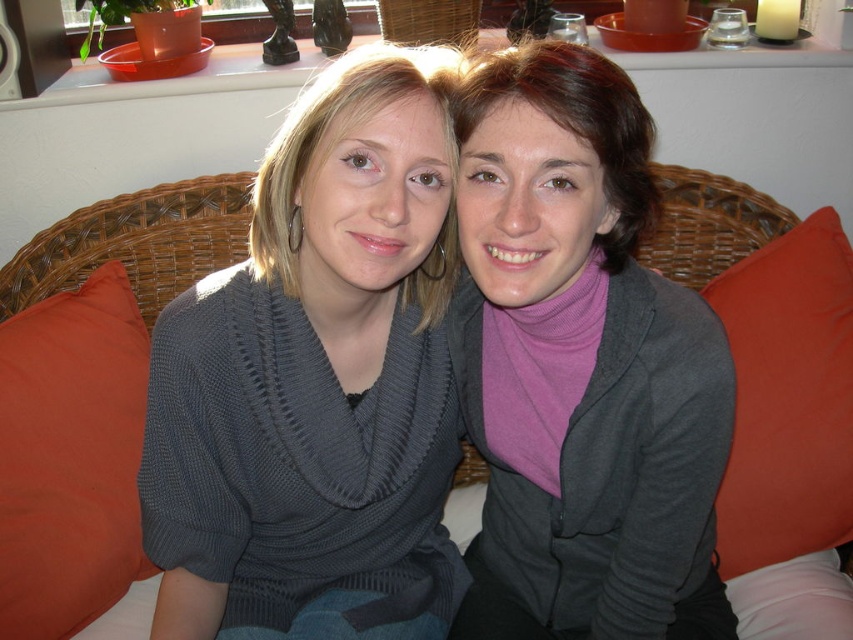
Question: Can you confirm if purple matte turtleneck at center is positioned to the right of orange fabric pillow at right?

Choices:
 (A) yes
 (B) no

Answer: (B)

Question: Is orange fabric pillow at left thinner than woven wicker couch at center?

Choices:
 (A) no
 (B) yes

Answer: (B)

Question: Which of the following is the farthest from the observer?

Choices:
 (A) (283, 518)
 (B) (712, 634)
 (C) (181, 189)
 (D) (735, 509)

Answer: (C)

Question: Among these points, which one is farthest from the camera?

Choices:
 (A) (695, 269)
 (B) (413, 316)
 (C) (3, 508)
 (D) (532, 481)

Answer: (A)

Question: Which of the following is the farthest from the observer?

Choices:
 (A) (741, 385)
 (B) (166, 408)
 (C) (149, 273)

Answer: (C)

Question: Is gray knit sweater at center to the left of orange fabric pillow at left from the viewer's perspective?

Choices:
 (A) yes
 (B) no

Answer: (B)